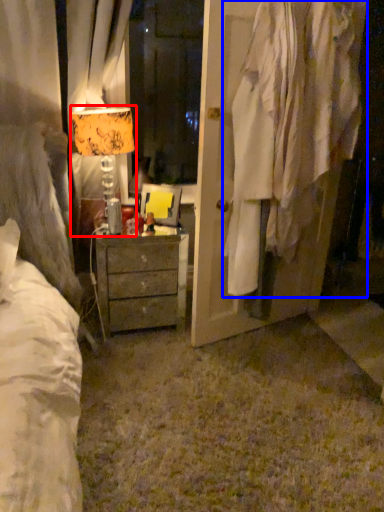
Question: Which of the following is the closest to the observer, table lamp (highlighted by a red box) or clothing (highlighted by a blue box)?

Choices:
 (A) table lamp
 (B) clothing

Answer: (B)